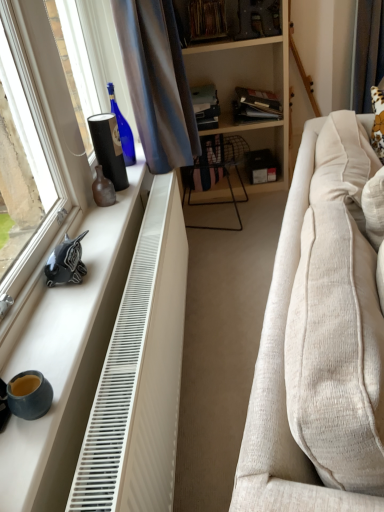
Locate an element on the screen. free space in front of brown matte vase at left is located at coordinates (104, 217).